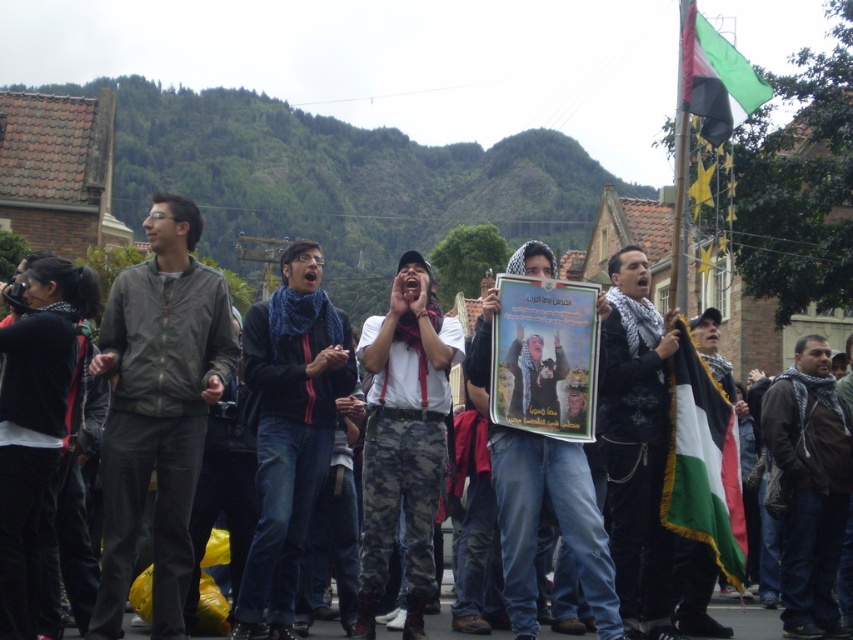
You are a photographer at the demonstration. You need to capture a photo that includes both the white scarf at center and the green fabric flag at upper right. Which object should you focus on first to ensure both are in frame?

You should focus on the white scarf at center first since it is taller than the green fabric flag at upper right, ensuring it fits within the frame while also capturing the smaller flag.

Looking at the scene of the public demonstration, where is the dark blue scarf at center in relation to the green fabric flag at upper right?

The dark blue scarf at center is to the left of the green fabric flag at upper right.